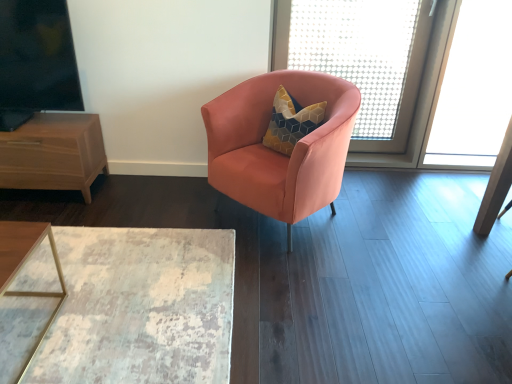
Identify the location of free space underneath black glass window screen at upper left, arranged as the 1th window screen when viewed from the front (from a real-world perspective). This screenshot has width=512, height=384. (45, 119).